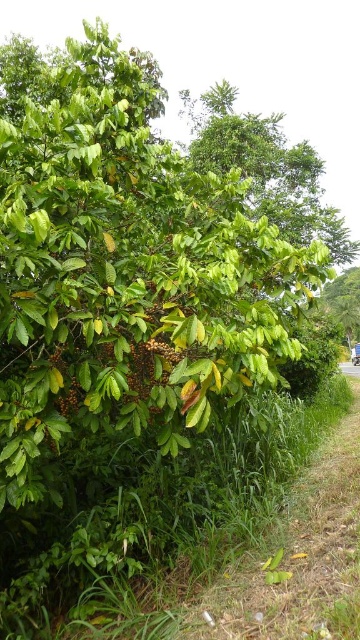
Question: Which of these objects is positioned farthest from the gravel path at lower right?

Choices:
 (A) green leafy tree at upper right
 (B) green leafy tree at upper center

Answer: (B)

Question: Which point is farther from the camera taking this photo?

Choices:
 (A) pos(213,168)
 (B) pos(354,321)

Answer: (B)

Question: Is green leafy tree at upper right closer to the viewer compared to gravel path at lower right?

Choices:
 (A) yes
 (B) no

Answer: (B)

Question: Is green leafy tree at upper center bigger than green leafy tree at upper right?

Choices:
 (A) no
 (B) yes

Answer: (B)

Question: Is green leafy tree at upper center thinner than green leafy tree at upper right?

Choices:
 (A) no
 (B) yes

Answer: (A)

Question: Which of the following is the farthest from the observer?

Choices:
 (A) (353, 337)
 (B) (263, 124)

Answer: (A)